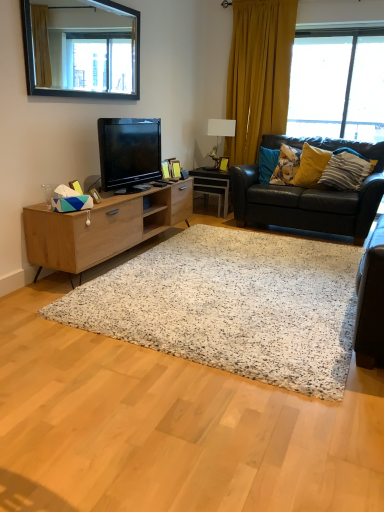
Find the location of a particular element. Image resolution: width=384 pixels, height=512 pixels. vacant space to the left of wooden picture frame at center is located at coordinates (214, 169).